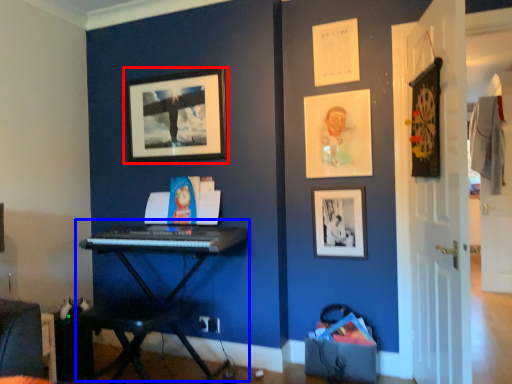
Question: Which of the following is the closest to the observer, picture frame (highlighted by a red box) or piano (highlighted by a blue box)?

Choices:
 (A) picture frame
 (B) piano

Answer: (B)